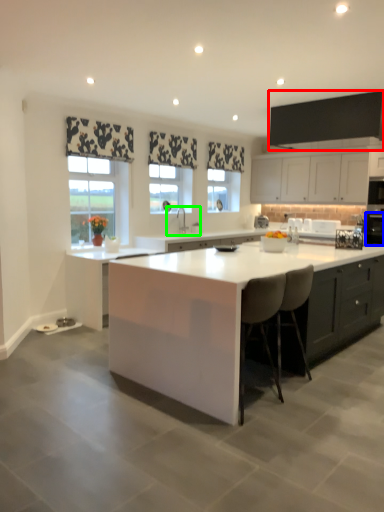
Question: Which object is the closest to the cabinetry (highlighted by a red box)? Choose among these: appliance (highlighted by a blue box) or sink (highlighted by a green box).

Choices:
 (A) appliance
 (B) sink

Answer: (A)